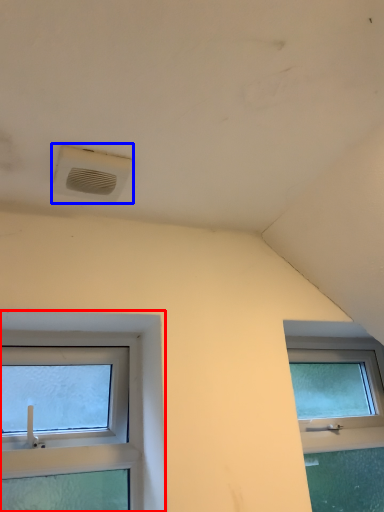
Question: Among these objects, which one is nearest to the camera, window (highlighted by a red box) or air conditioning (highlighted by a blue box)?

Choices:
 (A) window
 (B) air conditioning

Answer: (B)